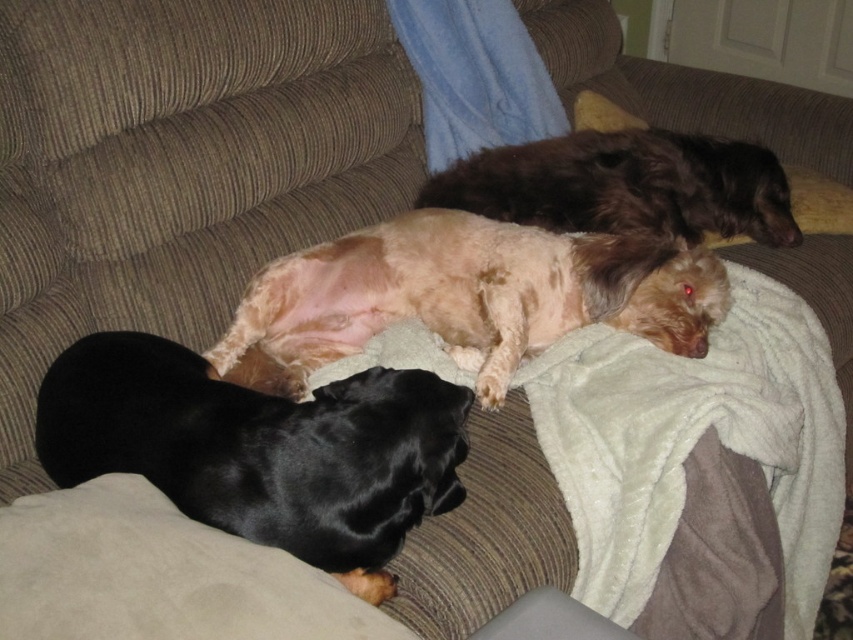
Where is `shiny black dog at lower left`? This screenshot has width=853, height=640. shiny black dog at lower left is located at coordinates (260, 449).

Is shiny black dog at lower left positioned at the back of white fabric at lower center?

Yes, it is.

Locate an element on the screen. shiny black dog at lower left is located at coordinates pos(260,449).

Is fuzzy beige dog at center to the left of white fabric at lower center from the viewer's perspective?

Indeed, fuzzy beige dog at center is positioned on the left side of white fabric at lower center.

Identify the location of fuzzy beige dog at center. (465, 296).

What are the coordinates of `fuzzy beige dog at center` in the screenshot? It's located at (465, 296).

Based on the photo, between suede-like beige pillow at lower left and shiny brown fur at upper right, which one is positioned lower?

suede-like beige pillow at lower left is lower down.

Is point (77, 620) closer to viewer compared to point (631, 150)?

Yes, point (77, 620) is closer to viewer.

Where is `suede-like beige pillow at lower left`? suede-like beige pillow at lower left is located at coordinates (158, 576).